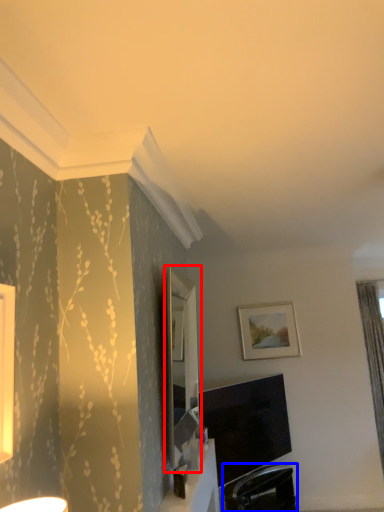
Question: Which of the following is the closest to the observer, mirror (highlighted by a red box) or swivel chair (highlighted by a blue box)?

Choices:
 (A) mirror
 (B) swivel chair

Answer: (A)